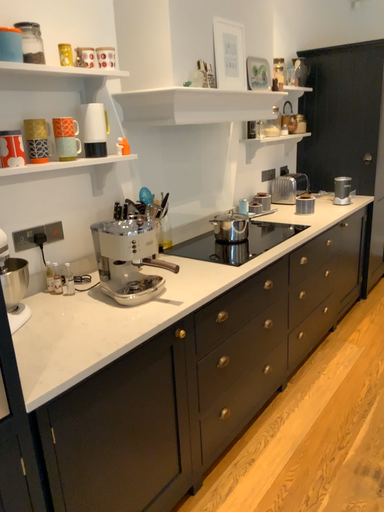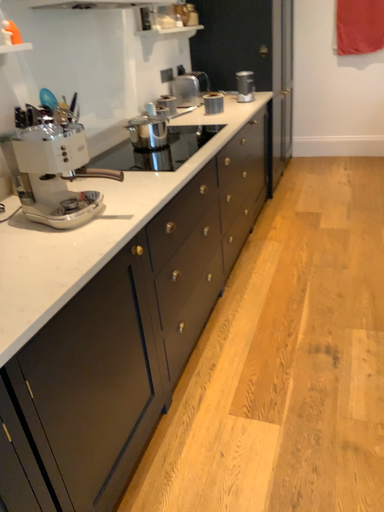
Question: How did the camera likely rotate when shooting the video?

Choices:
 (A) rotated right
 (B) rotated left

Answer: (A)